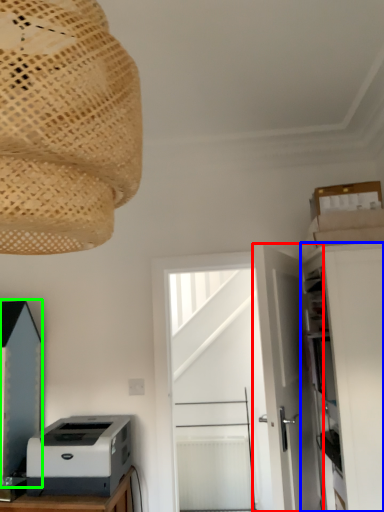
Question: Considering the real-world distances, which object is closest to door (highlighted by a red box)? cabinetry (highlighted by a blue box) or cabinetry (highlighted by a green box).

Choices:
 (A) cabinetry
 (B) cabinetry

Answer: (A)